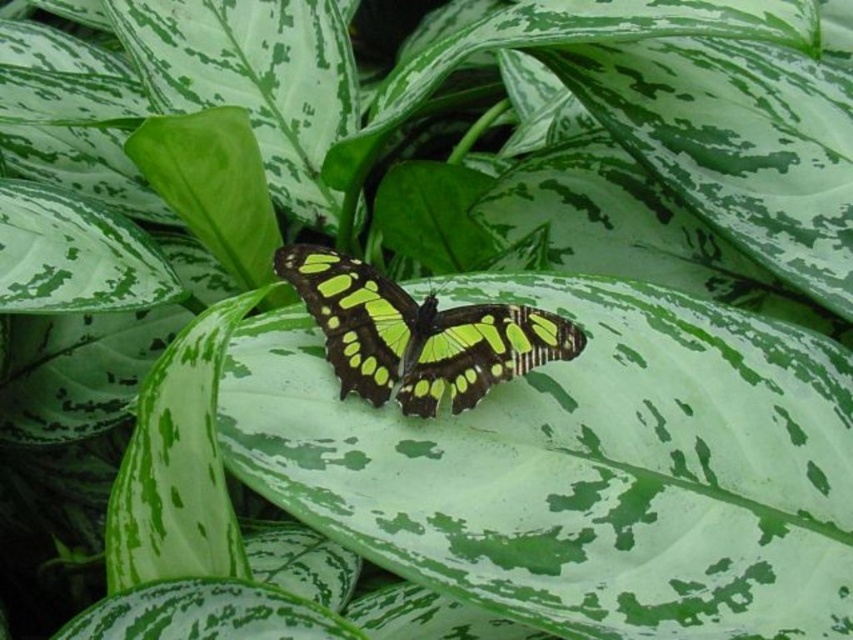
Question: Is green matte leaf at center smaller than green iridescent wings at center?

Choices:
 (A) no
 (B) yes

Answer: (A)

Question: Is the position of green matte leaf at center less distant than that of green iridescent wings at center?

Choices:
 (A) no
 (B) yes

Answer: (B)

Question: Which point appears farthest from the camera in this image?

Choices:
 (A) (454, 412)
 (B) (554, 460)

Answer: (B)

Question: Which point is farther to the camera?

Choices:
 (A) (775, 403)
 (B) (403, 388)

Answer: (A)

Question: Does green matte leaf at center lie in front of green iridescent wings at center?

Choices:
 (A) yes
 (B) no

Answer: (A)